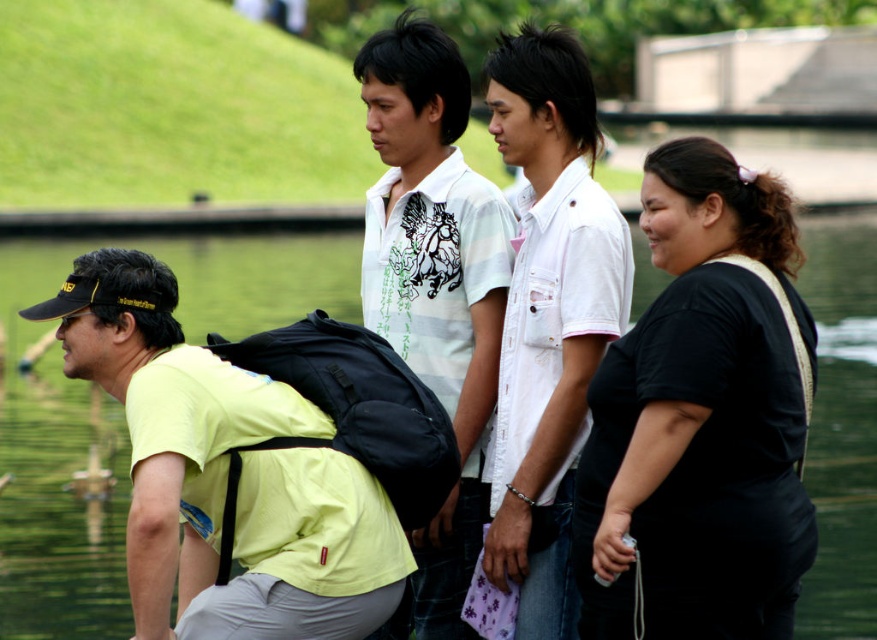
You are a photographer trying to capture a group photo of the black matte shirt at right and the white striped polo shirt at center. Based on their sizes in the image, which person should you position closer to the camera to make them appear the same size?

The black matte shirt at right occupies less space than the white striped polo shirt at center, so you should position the black matte shirt at right closer to the camera to make them appear the same size.